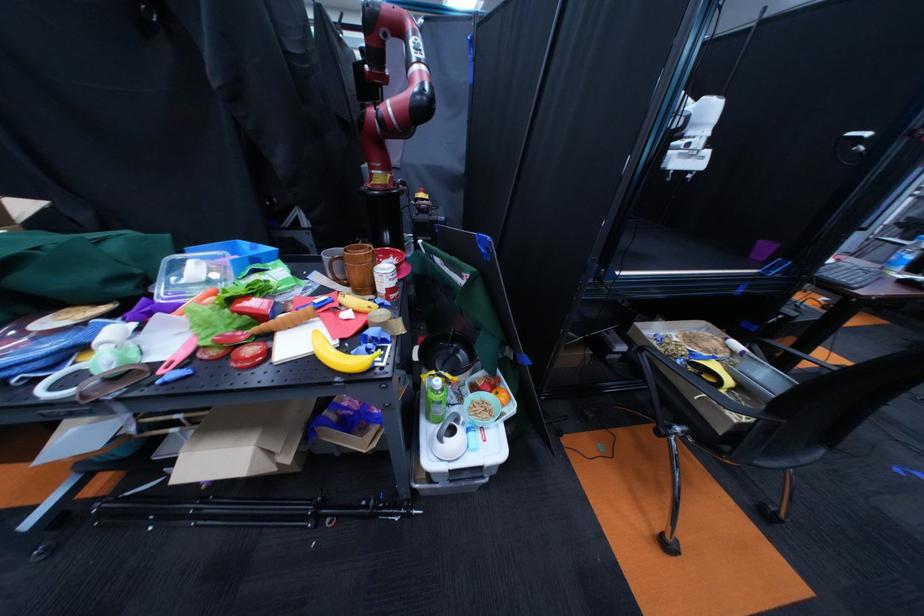
Find the location of a particular element. cardboard tray is located at coordinates (712, 369).